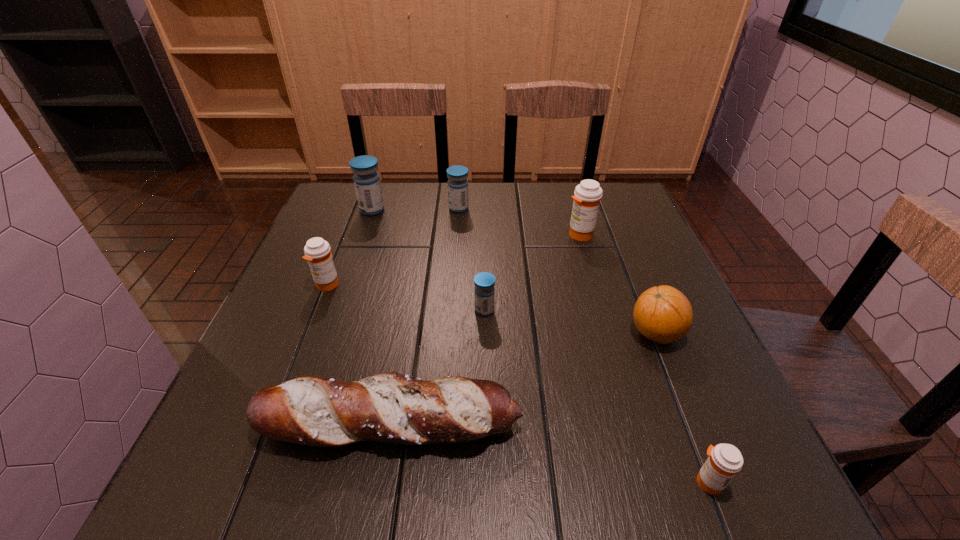
Find the location of `free spot between the second nearest medicine and the leftmost blue medicine`. free spot between the second nearest medicine and the leftmost blue medicine is located at coordinates (428, 260).

Locate an element on the screen. This screenshot has width=960, height=540. empty location between the second biggest blue medicine and the nearest blue medicine is located at coordinates (471, 259).

Find the location of a particular element. The image size is (960, 540). empty location between the nearest medicine and the second nearest object is located at coordinates (549, 453).

Identify the location of unoccupied position between the orange and the rightmost blue medicine. The image size is (960, 540). (570, 322).

At what (x,y) coordinates should I click in order to perform the action: click on vacant space that is in between the rightmost medicine and the smallest blue medicine. Please return your answer as a coordinate pair (x, y). The height and width of the screenshot is (540, 960). Looking at the image, I should click on (596, 396).

The width and height of the screenshot is (960, 540). Identify the location of unoccupied area between the third medicine from left to right and the sixth object from left to right. (519, 221).

The height and width of the screenshot is (540, 960). What are the coordinates of `object identified as the seventh closest to the second smallest orange medicine` in the screenshot? It's located at (725, 460).

Locate which object is the third closest to the rightmost medicine. Please provide its 2D coordinates. Your answer should be formatted as a tuple, i.e. [(x, y)], where the tuple contains the x and y coordinates of a point satisfying the conditions above.

[(484, 292)]

What are the coordinates of `medicine that is the fourth closest to the orange orange` in the screenshot? It's located at pos(457,184).

Identify the location of medicine that is the fifth nearest to the third nearest medicine. (725, 460).